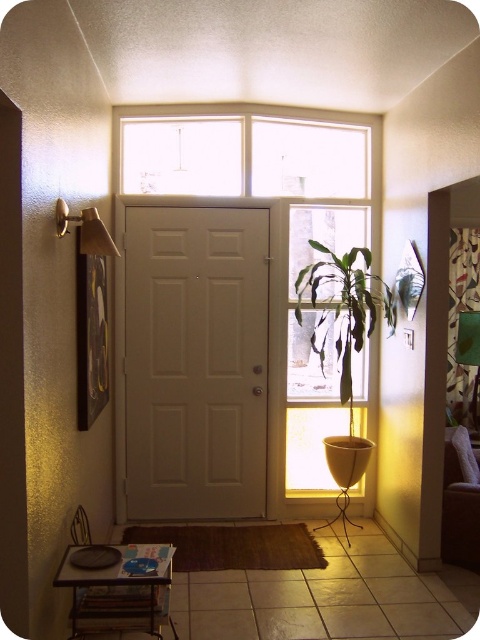
Is point (137, 456) in front of point (87, 228)?

That is False.

Is white matte door at center taller than metallic brass door handle at upper left?

Yes.

The height and width of the screenshot is (640, 480). I want to click on white matte door at center, so click(195, 362).

Which is in front, point (193, 264) or point (331, 236)?

Point (193, 264) is in front.

Does white matte door at center come behind translucent glass window at center?

No, white matte door at center is in front of translucent glass window at center.

Between point (242, 227) and point (294, 420), which one is positioned in front?

Point (242, 227) is more forward.

Where is `white matte door at center`? white matte door at center is located at coordinates (195, 362).

Can you confirm if white matte door at center is shorter than green leafy plant at center?

No, white matte door at center is not shorter than green leafy plant at center.

Can you confirm if white matte door at center is positioned to the right of green leafy plant at center?

In fact, white matte door at center is to the left of green leafy plant at center.

Locate an element on the screen. This screenshot has height=640, width=480. white matte door at center is located at coordinates (195, 362).